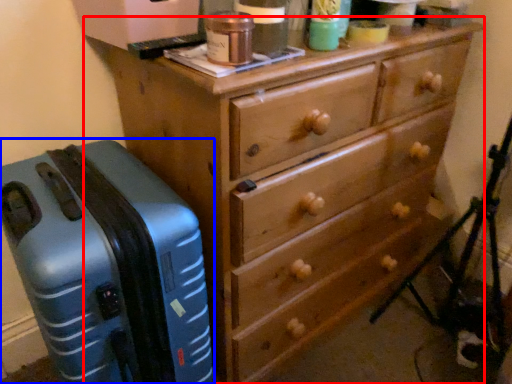
Question: Among these objects, which one is farthest to the camera, chest of drawers (highlighted by a red box) or suitcase (highlighted by a blue box)?

Choices:
 (A) chest of drawers
 (B) suitcase

Answer: (A)